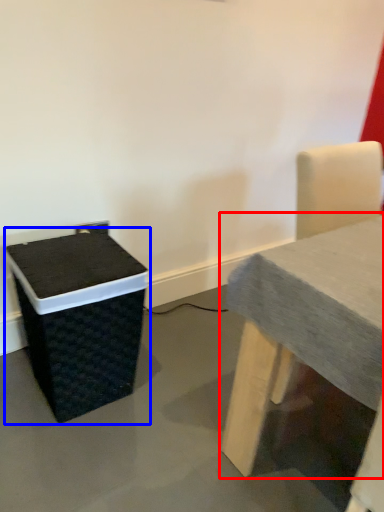
Question: Which object appears farthest to the camera in this image, table (highlighted by a red box) or recycling bin (highlighted by a blue box)?

Choices:
 (A) table
 (B) recycling bin

Answer: (B)